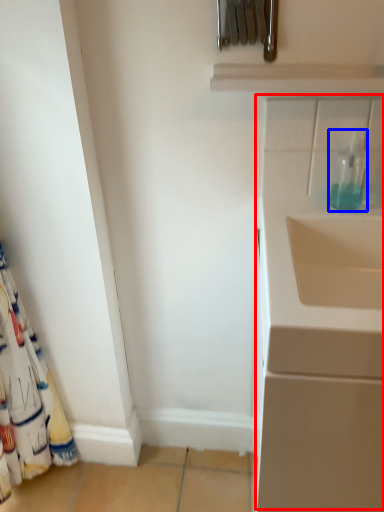
Question: Which point is further to the camera, wide (highlighted by a red box) or bottle (highlighted by a blue box)?

Choices:
 (A) wide
 (B) bottle

Answer: (B)